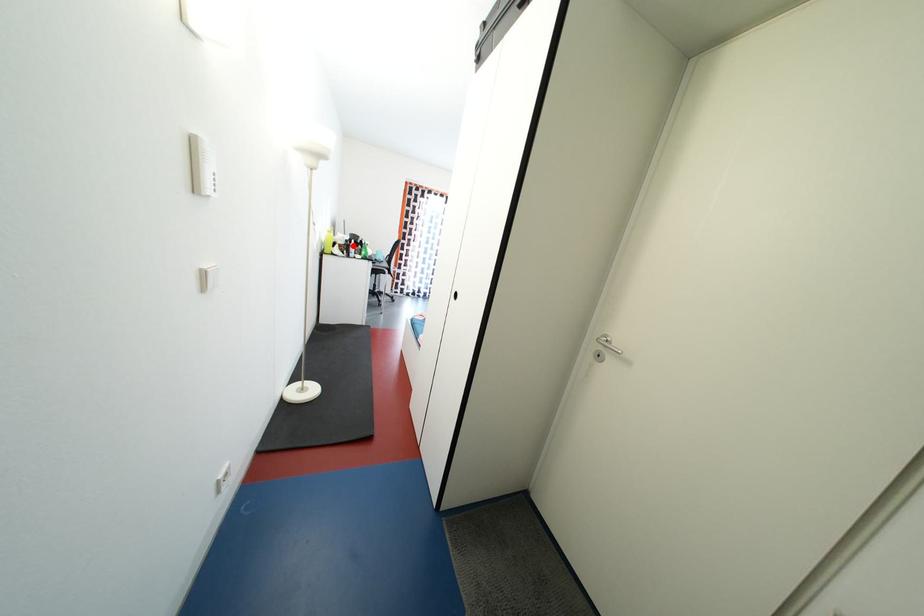
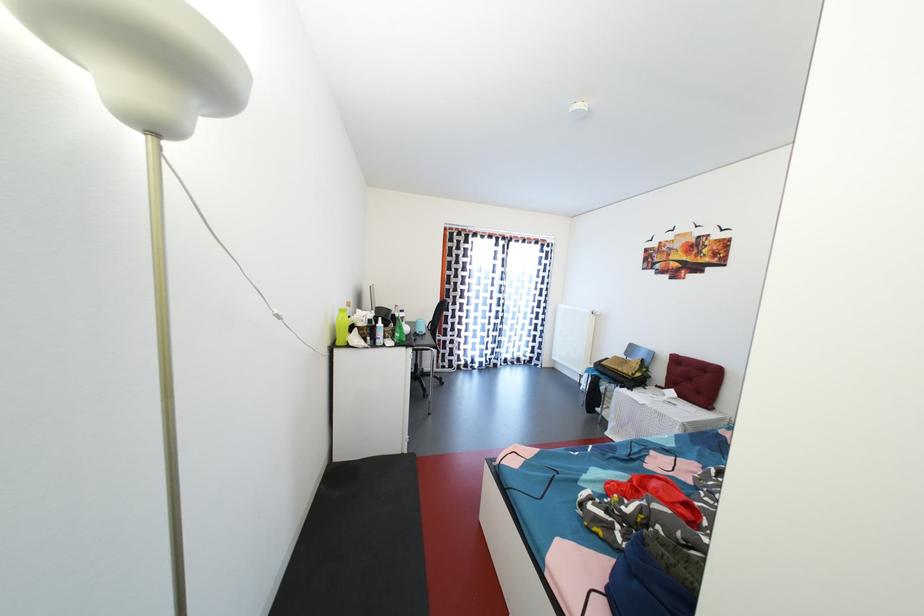
Question: I am providing you with two images of the same scene from different viewpoints. A red point is shown in image1. For the corresponding object point in image2, is it positioned nearer or farther from the camera?

Choices:
 (A) Nearer
 (B) Farther

Answer: (B)